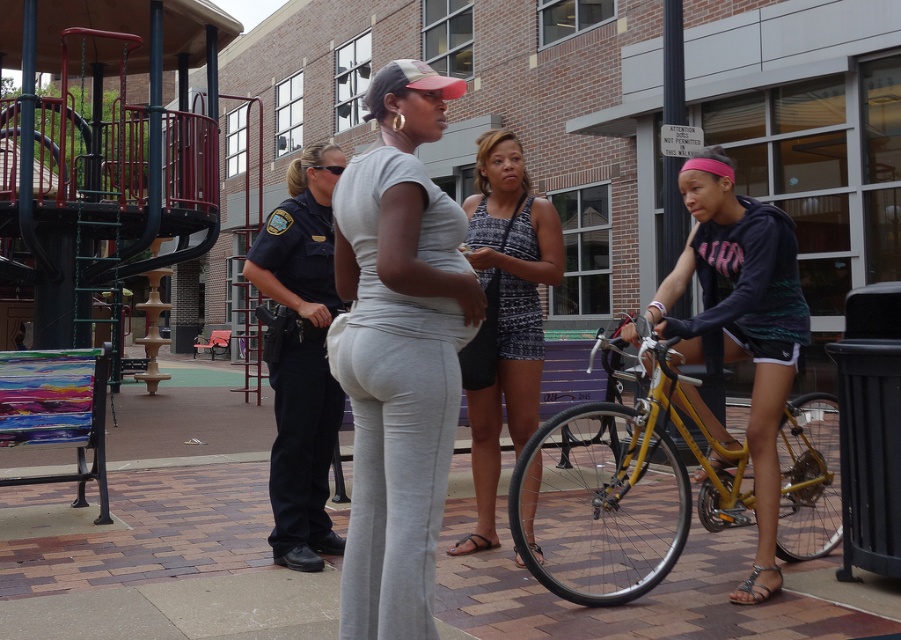
You are a delivery person who needs to load both the yellow metallic bicycle at right and the dark blue uniform at left into your van. The van has a height restriction of 1.5 meters. Which item is more likely to exceed the height limit?

The dark blue uniform at left is taller than the yellow metallic bicycle at right, so the dark blue uniform at left is more likely to exceed the height limit of 1.5 meters.

You are a delivery person trying to navigate through the scene. There is a yellow metallic bicycle at right and a dark blue uniform at left. Which object is wider, potentially blocking your path?

The yellow metallic bicycle at right is wider than the dark blue uniform at left, so it might block your path more.

You are standing at the point marked as point [229,541] in the image. You want to walk towards the police officer in the background. Is the police officer closer to you than 5 meters?

The distance of point [229,541] from viewer is 4.58 meters, so the police officer is closer than 5 meters from the point.